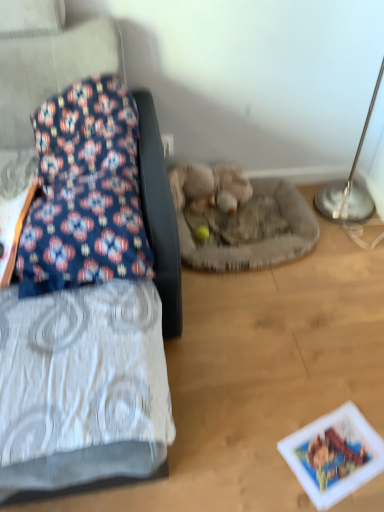
Locate an element on the screen. The width and height of the screenshot is (384, 512). free spot below silver metallic table lamp at upper right (from a real-world perspective) is located at coordinates (330, 217).